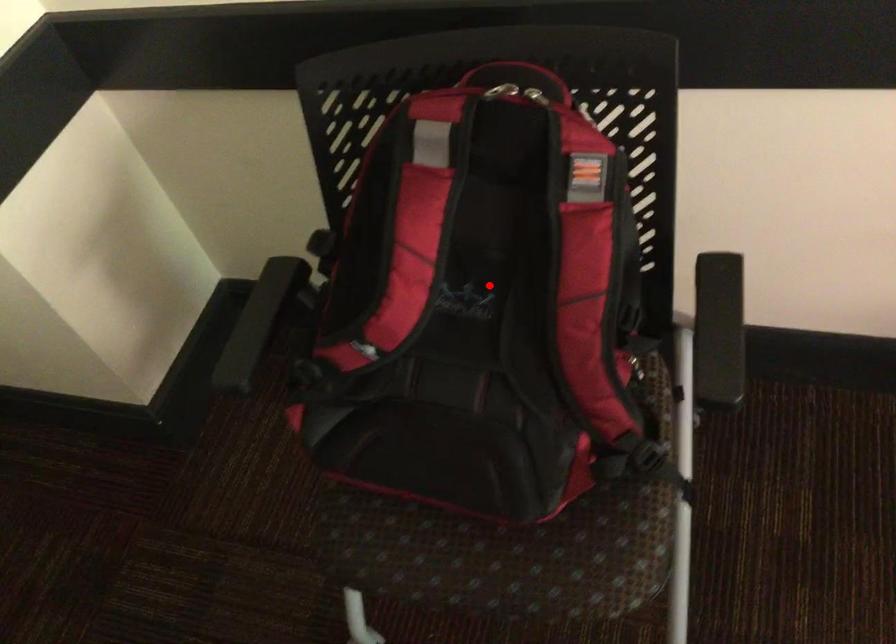
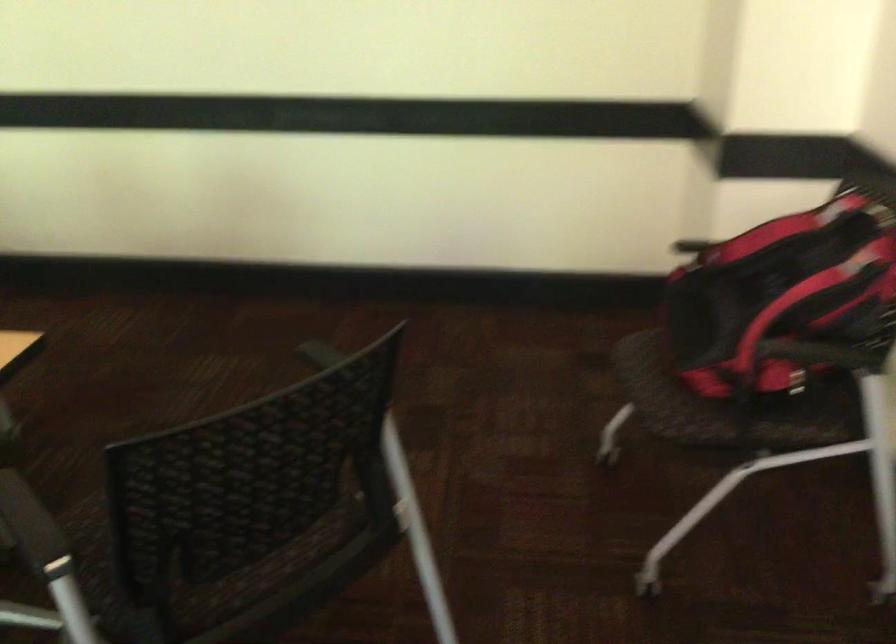
Question: I am providing you with two images of the same scene from different viewpoints. In image1, a red point is highlighted. Considering the same 3D point in image2, which of the following is correct?

Choices:
 (A) It is closer
 (B) It is farther

Answer: (B)